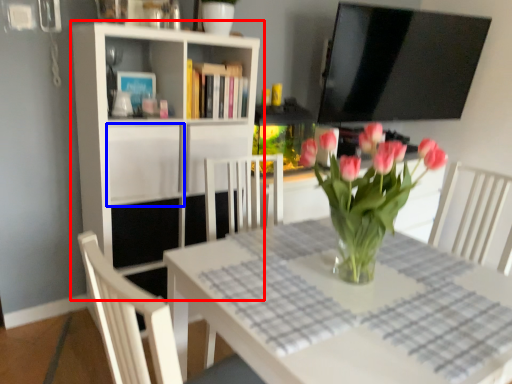
Question: Which object is closer to the camera taking this photo, shelf (highlighted by a red box) or cabinet (highlighted by a blue box)?

Choices:
 (A) shelf
 (B) cabinet

Answer: (A)